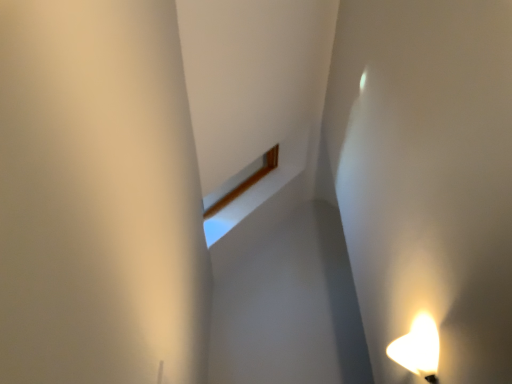
This screenshot has width=512, height=384. Describe the element at coordinates (418, 348) in the screenshot. I see `white glossy lamp at lower right` at that location.

The height and width of the screenshot is (384, 512). I want to click on white glossy lamp at lower right, so pyautogui.click(x=418, y=348).

In order to face white glossy lamp at lower right, should I rotate leftwards or rightwards?

To align with it, rotate right about 19.558°.

Identify the location of white glossy lamp at lower right. The height and width of the screenshot is (384, 512). (418, 348).